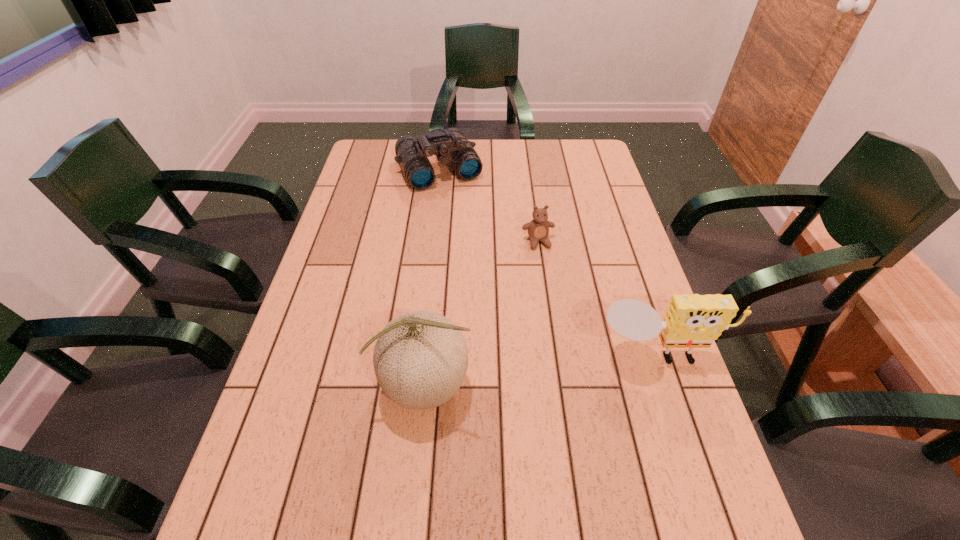
In order to click on free spot between the farthest object and the sponge in this screenshot , I will do `click(549, 262)`.

You are a GUI agent. You are given a task and a screenshot of the screen. Output one action in this format:
    pyautogui.click(x=<x>, y=<y>)
    Task: Click on the vacant space that is in between the farthest object and the third nearest object
    The height and width of the screenshot is (540, 960).
    Given the screenshot: What is the action you would take?
    pyautogui.click(x=489, y=206)

Where is `vacant area that lies between the teddy bear and the sponge`? The width and height of the screenshot is (960, 540). vacant area that lies between the teddy bear and the sponge is located at coordinates (598, 298).

The image size is (960, 540). I want to click on vacant space that's between the third tallest object and the tallest object, so click(432, 278).

Locate an element on the screen. free space that is in between the cantaloup and the binoculars is located at coordinates (432, 278).

Find the location of a particular element. vacant area between the third tallest object and the rightmost object is located at coordinates (549, 262).

Where is `object identified as the closest to the farthest object`? The image size is (960, 540). object identified as the closest to the farthest object is located at coordinates (538, 229).

Locate which object ranks in proximity to the shortest object. Please provide its 2D coordinates. Your answer should be formatted as a tuple, i.e. [(x, y)], where the tuple contains the x and y coordinates of a point satisfying the conditions above.

[(450, 145)]